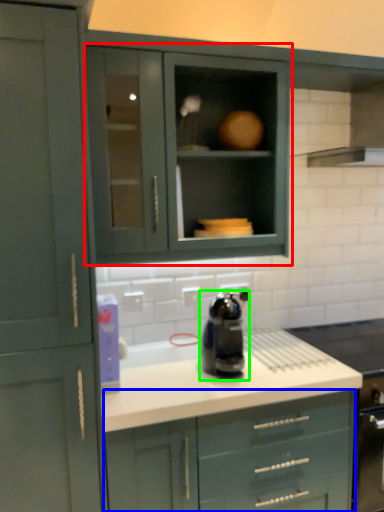
Question: Based on their relative distances, which object is farther from cabinetry (highlighted by a red box)? Choose from cabinetry (highlighted by a blue box) and home appliance (highlighted by a green box).

Choices:
 (A) cabinetry
 (B) home appliance

Answer: (A)